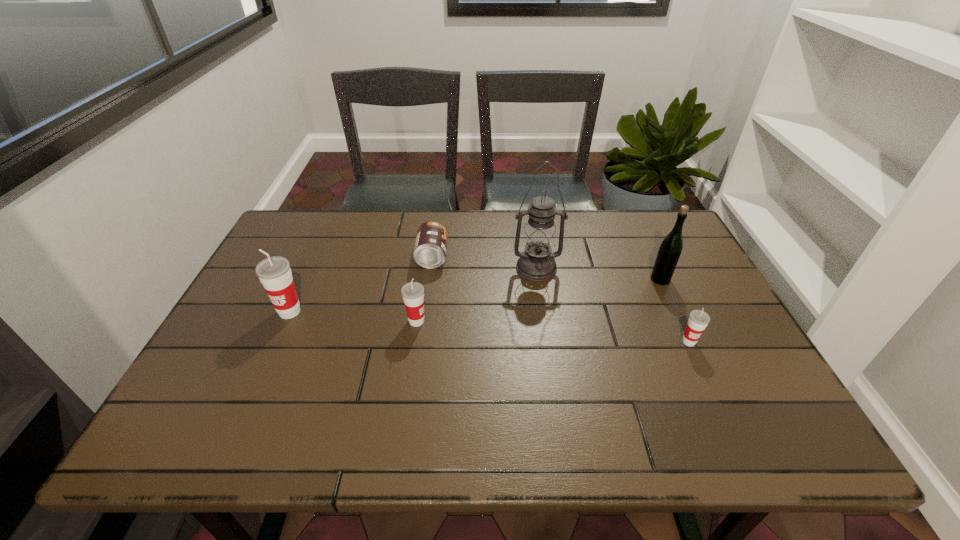
Image resolution: width=960 pixels, height=540 pixels. Identify the location of vacant space that satisfies the following two spatial constraints: 1. on the front label of the shortest object; 2. on the back side of the fourth object from left to right. (431, 268).

Identify the location of blank space that satisfies the following two spatial constraints: 1. on the front label of the can; 2. on the side of the tallest cup with the logo. The image size is (960, 540). (425, 312).

I want to click on vacant region that satisfies the following two spatial constraints: 1. on the front label of the can; 2. on the back side of the beer bottle, so click(x=429, y=279).